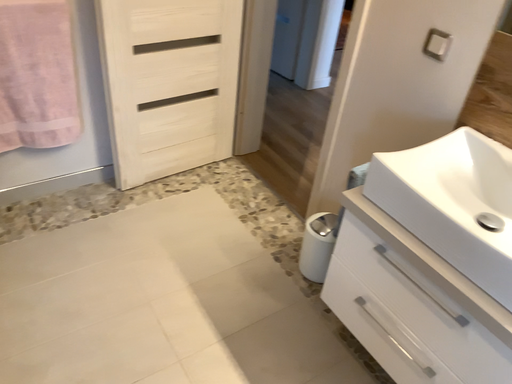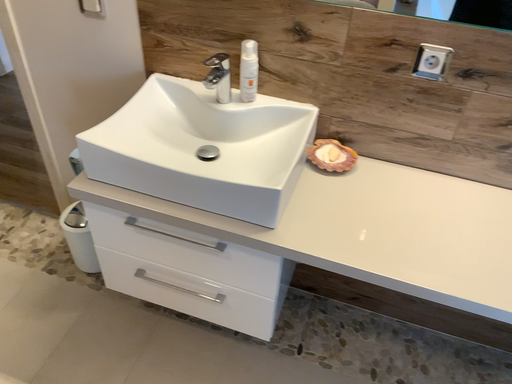
Question: How did the camera likely rotate when shooting the video?

Choices:
 (A) rotated right
 (B) rotated left

Answer: (A)